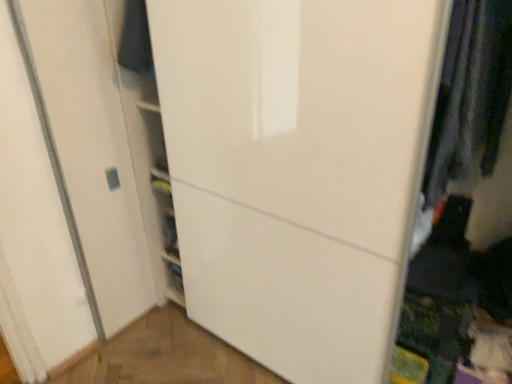
Question: Is dark gray fabric at right, which is counted as the 1th clothing, starting from the front, looking in the opposite direction of dark blue fabric at upper left, which is counted as the first clothing, starting from the left?

Choices:
 (A) no
 (B) yes

Answer: (A)

Question: From the image's perspective, is dark gray fabric at right, marked as the second clothing in a back-to-front arrangement, beneath dark blue fabric at upper left, which is the 2th clothing from right to left?

Choices:
 (A) no
 (B) yes

Answer: (B)

Question: Can you confirm if dark gray fabric at right, positioned as the 1th clothing in right-to-left order, is shorter than dark blue fabric at upper left, which is the 2th clothing from right to left?

Choices:
 (A) no
 (B) yes

Answer: (A)

Question: From a real-world perspective, is dark gray fabric at right, marked as the second clothing in a back-to-front arrangement, on dark blue fabric at upper left, positioned as the 2th clothing in front-to-back order?

Choices:
 (A) no
 (B) yes

Answer: (A)

Question: Considering their positions, is dark blue fabric at upper left, which is the 2th clothing from right to left, located in front of or behind dark gray fabric at right, marked as the second clothing in a back-to-front arrangement?

Choices:
 (A) behind
 (B) front

Answer: (A)

Question: Is dark blue fabric at upper left, which is counted as the first clothing, starting from the left, wider or thinner than dark gray fabric at right, which is counted as the 1th clothing, starting from the front?

Choices:
 (A) thin
 (B) wide

Answer: (A)

Question: From their relative heights in the image, would you say dark blue fabric at upper left, which is counted as the first clothing, starting from the left, is taller or shorter than dark gray fabric at right, marked as the second clothing in a back-to-front arrangement?

Choices:
 (A) tall
 (B) short

Answer: (B)

Question: From a real-world perspective, is dark blue fabric at upper left, the 1th clothing from the back, positioned above or below dark gray fabric at right, marked as the second clothing in a left-to-right arrangement?

Choices:
 (A) below
 (B) above

Answer: (B)

Question: Is dark blue fabric at upper left, the 1th clothing from the back, to the left or to the right of white glossy door at center in the image?

Choices:
 (A) left
 (B) right

Answer: (A)

Question: Is dark blue fabric at upper left, positioned as the 2th clothing in front-to-back order, situated inside white glossy door at center or outside?

Choices:
 (A) outside
 (B) inside

Answer: (B)

Question: From a real-world perspective, is dark blue fabric at upper left, which is counted as the first clothing, starting from the left, positioned above or below white glossy door at center?

Choices:
 (A) above
 (B) below

Answer: (A)

Question: From the image's perspective, is dark blue fabric at upper left, the 1th clothing from the back, positioned above or below white glossy door at center?

Choices:
 (A) above
 (B) below

Answer: (A)

Question: Considering the relative positions of dark gray fabric at right, marked as the second clothing in a left-to-right arrangement, and white glossy door at center in the image provided, is dark gray fabric at right, marked as the second clothing in a left-to-right arrangement, to the left or to the right of white glossy door at center?

Choices:
 (A) left
 (B) right

Answer: (B)

Question: From the image's perspective, is dark gray fabric at right, marked as the second clothing in a back-to-front arrangement, positioned above or below white glossy door at center?

Choices:
 (A) above
 (B) below

Answer: (A)